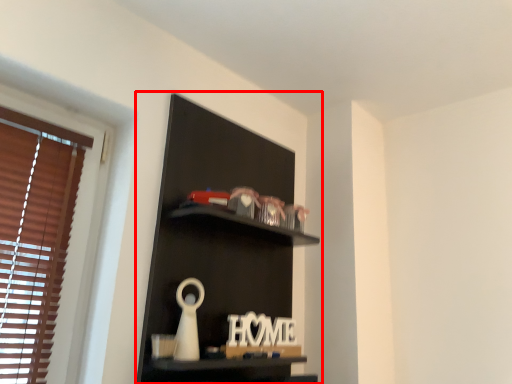
Question: Where is shelf (annotated by the red box) located in relation to letter in the image?

Choices:
 (A) right
 (B) left

Answer: (B)